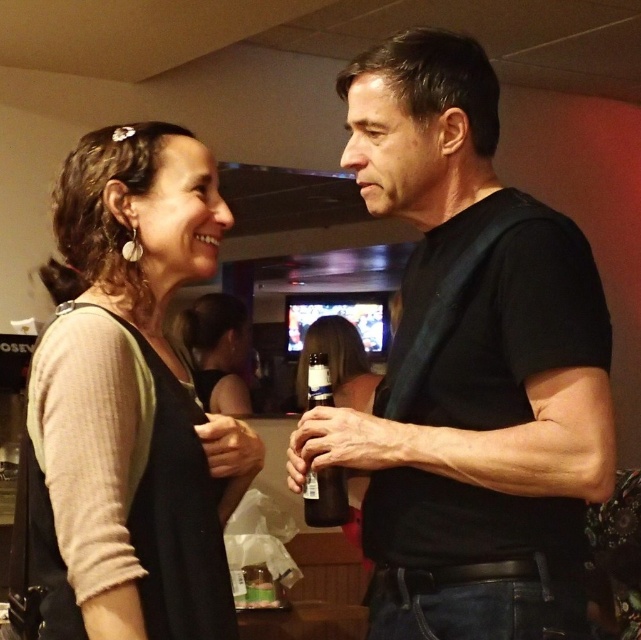
Question: Which of the following is the closest to the observer?

Choices:
 (A) (328, 504)
 (B) (395, 349)
 (C) (242, 362)
 (D) (47, 436)

Answer: (D)

Question: Can you confirm if black matte shirt at center is smaller than matte black top at left?

Choices:
 (A) yes
 (B) no

Answer: (B)

Question: Does black matte shirt at center appear on the left side of translucent glass bottle at center?

Choices:
 (A) no
 (B) yes

Answer: (A)

Question: Is matte black top at left wider than translucent glass bottle at center?

Choices:
 (A) yes
 (B) no

Answer: (A)

Question: Which point is farther to the camera?

Choices:
 (A) (551, 472)
 (B) (235, 369)
 (C) (312, 490)
 (D) (187, 614)

Answer: (B)

Question: Estimate the real-world distances between objects in this image. Which object is farther from the matte black hair at center?

Choices:
 (A) black matte shirt at center
 (B) translucent glass bottle at center

Answer: (A)